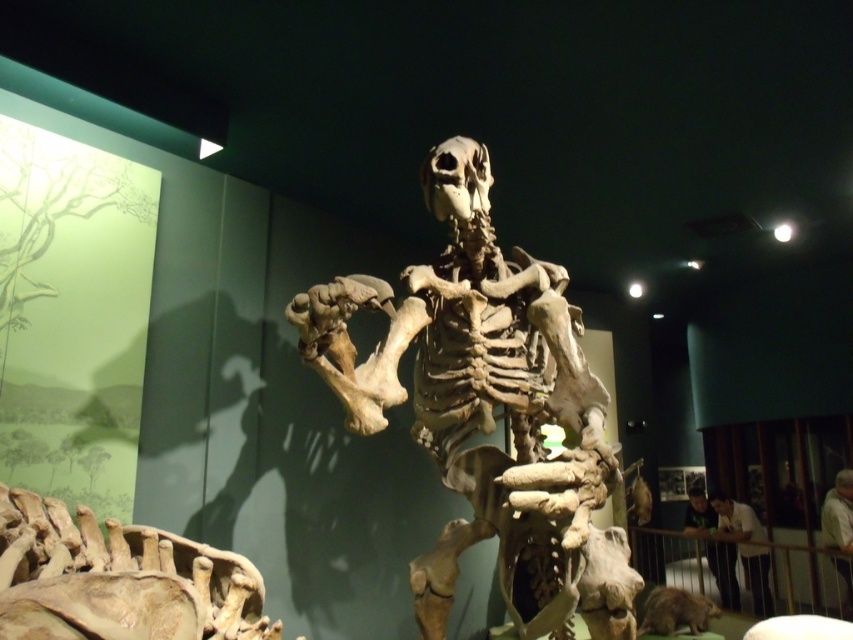
Is brown bone-like skeleton at center in front of light brown shirt at lower right?

That is True.

What do you see at coordinates (490, 426) in the screenshot? The width and height of the screenshot is (853, 640). I see `brown bone-like skeleton at center` at bounding box center [490, 426].

You are a GUI agent. You are given a task and a screenshot of the screen. Output one action in this format:
    pyautogui.click(x=<x>, y=<y>)
    Task: Click on the brown bone-like skeleton at center
    The width and height of the screenshot is (853, 640).
    Given the screenshot: What is the action you would take?
    pyautogui.click(x=490, y=426)

Is the position of brown furry animal at lower right more distant than that of white cloth shirt at lower right?

That is False.

Can you confirm if brown furry animal at lower right is thinner than white cloth shirt at lower right?

Incorrect, brown furry animal at lower right's width is not less than white cloth shirt at lower right's.

Where is `brown furry animal at lower right`? brown furry animal at lower right is located at coordinates (675, 611).

Is brown bone-like skeleton at center to the left of bone-like skull at center from the viewer's perspective?

In fact, brown bone-like skeleton at center is to the right of bone-like skull at center.

Does point (479, 326) come behind point (467, 198)?

That is True.

Describe the element at coordinates (490, 426) in the screenshot. I see `brown bone-like skeleton at center` at that location.

The width and height of the screenshot is (853, 640). I want to click on brown bone-like skeleton at center, so coord(490,426).